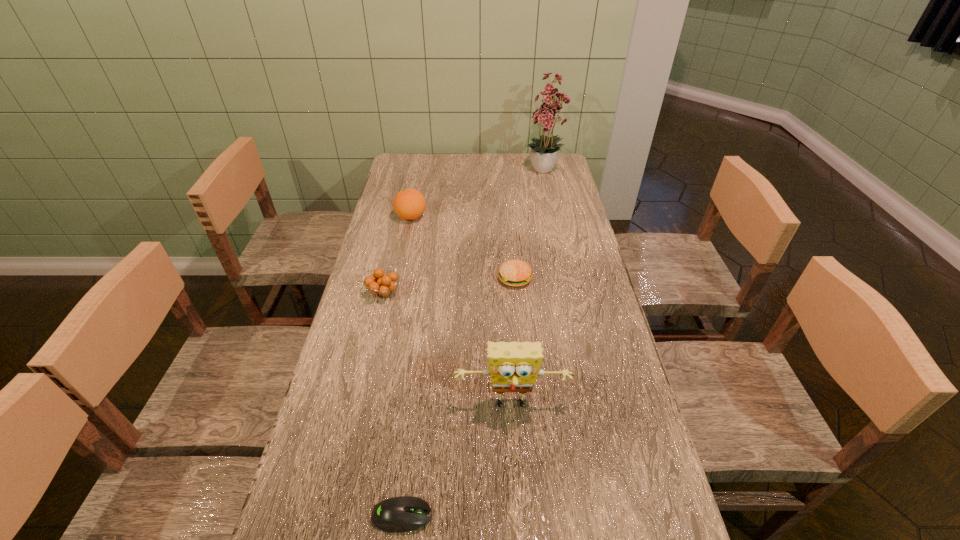
You are a GUI agent. You are given a task and a screenshot of the screen. Output one action in this format:
    pyautogui.click(x=<x>, y=<y>)
    Task: Click on the computer mouse
    
    Given the screenshot: What is the action you would take?
    pyautogui.click(x=399, y=514)

Identify the location of free location located 0.200m on the front-facing side of the flower arrangement. (555, 217).

The width and height of the screenshot is (960, 540). I want to click on vacant region located 0.150m on the face of the fifth farthest object, so click(x=516, y=488).

The height and width of the screenshot is (540, 960). Identify the location of free space located on the right of the taller orange fruit. (456, 217).

This screenshot has width=960, height=540. Identify the location of free space located on the back of the fourth tallest object. (396, 238).

The height and width of the screenshot is (540, 960). Find the location of `vacant region located on the back of the patty`. vacant region located on the back of the patty is located at coordinates (512, 243).

Find the location of `vacant space located 0.300m on the wheel side of the computer mouse`. vacant space located 0.300m on the wheel side of the computer mouse is located at coordinates (585, 516).

Locate an element on the screen. object situated at the far edge is located at coordinates (543, 152).

You are a GUI agent. You are given a task and a screenshot of the screen. Output one action in this format:
    pyautogui.click(x=<x>, y=<y>)
    Task: Click on the object present at the right edge
    This screenshot has height=540, width=960.
    Given the screenshot: What is the action you would take?
    pyautogui.click(x=543, y=152)

Locate an element on the screen. The width and height of the screenshot is (960, 540). object at the far right corner is located at coordinates (543, 152).